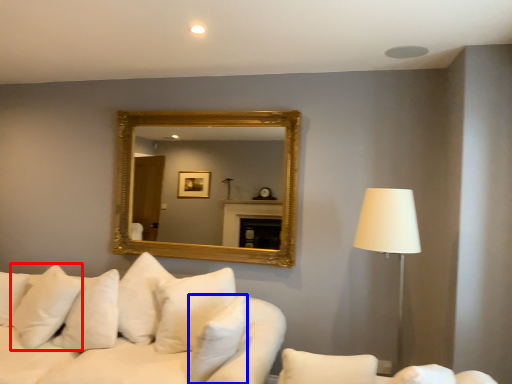
Question: Among these objects, which one is nearest to the camera, pillow (highlighted by a red box) or pillow (highlighted by a blue box)?

Choices:
 (A) pillow
 (B) pillow

Answer: (B)